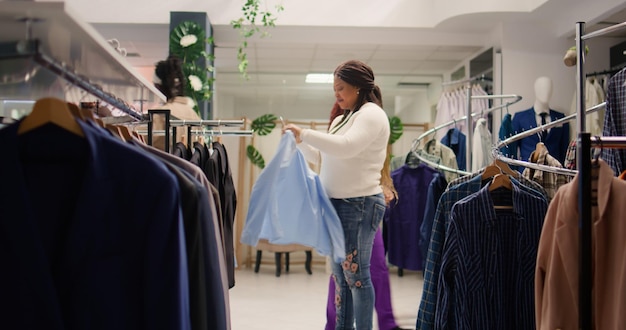
The image size is (626, 330). What are the coordinates of `ceiling tiles` in the screenshot? It's located at (290, 55).